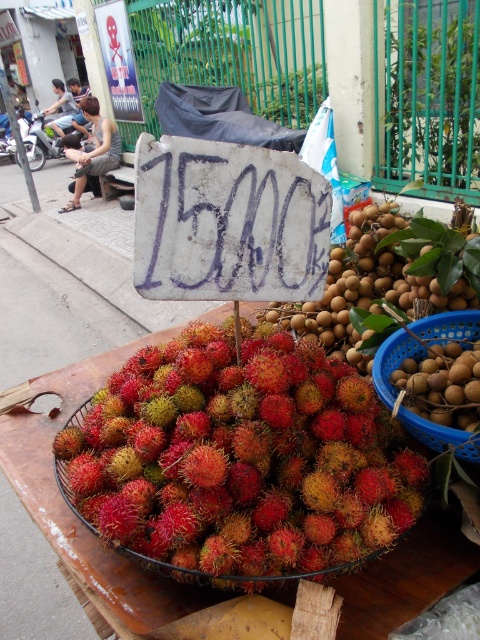
Is point (165, 381) more distant than point (66, 125)?

No, (165, 381) is in front of (66, 125).

Is hairy red rambutan at center to the right of dark gray fabric bag at upper left from the viewer's perspective?

Indeed, hairy red rambutan at center is positioned on the right side of dark gray fabric bag at upper left.

Does point (121, 436) come closer to viewer compared to point (72, 108)?

Yes, point (121, 436) is in front of point (72, 108).

This screenshot has height=640, width=480. I want to click on hairy red rambutan at center, so click(239, 464).

Which is more to the left, brown matte longan at center or brown matte longan at center-right?

brown matte longan at center is more to the left.

What do you see at coordinates (365, 282) in the screenshot? This screenshot has height=640, width=480. I see `brown matte longan at center` at bounding box center [365, 282].

Identify the location of brown matte longan at center. The image size is (480, 640). (365, 282).

Who is positioned more to the right, hairy red rambutan at center or brown matte longan at center?

Positioned to the right is brown matte longan at center.

Which is above, hairy red rambutan at center or brown matte longan at center?

brown matte longan at center is higher up.

Image resolution: width=480 pixels, height=640 pixels. Identify the location of hairy red rambutan at center. (239, 464).